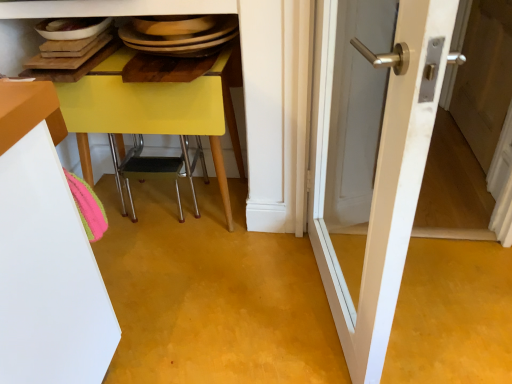
Question: Is white wood screen door at right shorter than yellow plastic chair at lower center?

Choices:
 (A) no
 (B) yes

Answer: (A)

Question: Is white wood screen door at right located outside yellow plastic chair at lower center?

Choices:
 (A) no
 (B) yes

Answer: (B)

Question: From a real-world perspective, is white wood screen door at right below yellow plastic chair at lower center?

Choices:
 (A) no
 (B) yes

Answer: (A)

Question: From the image's perspective, would you say white wood screen door at right is positioned over yellow plastic chair at lower center?

Choices:
 (A) yes
 (B) no

Answer: (A)

Question: Can you confirm if white wood screen door at right is taller than yellow plastic chair at lower center?

Choices:
 (A) no
 (B) yes

Answer: (B)

Question: Is yellow plastic chair at lower center surrounded by white wood screen door at right?

Choices:
 (A) yes
 (B) no

Answer: (B)

Question: From the image's perspective, would you say white wood screen door at right is shown under white glossy door at center?

Choices:
 (A) no
 (B) yes

Answer: (A)

Question: Does white wood screen door at right have a greater width compared to white glossy door at center?

Choices:
 (A) no
 (B) yes

Answer: (A)

Question: Considering the relative sizes of white wood screen door at right and white glossy door at center in the image provided, is white wood screen door at right smaller than white glossy door at center?

Choices:
 (A) no
 (B) yes

Answer: (B)

Question: Does white wood screen door at right lie in front of white glossy door at center?

Choices:
 (A) yes
 (B) no

Answer: (B)

Question: Is white wood screen door at right at the right side of white glossy door at center?

Choices:
 (A) yes
 (B) no

Answer: (A)

Question: Are white wood screen door at right and white glossy door at center located far from each other?

Choices:
 (A) no
 (B) yes

Answer: (B)

Question: Is white glossy door at center in front of yellow plastic chair at lower center?

Choices:
 (A) no
 (B) yes

Answer: (B)